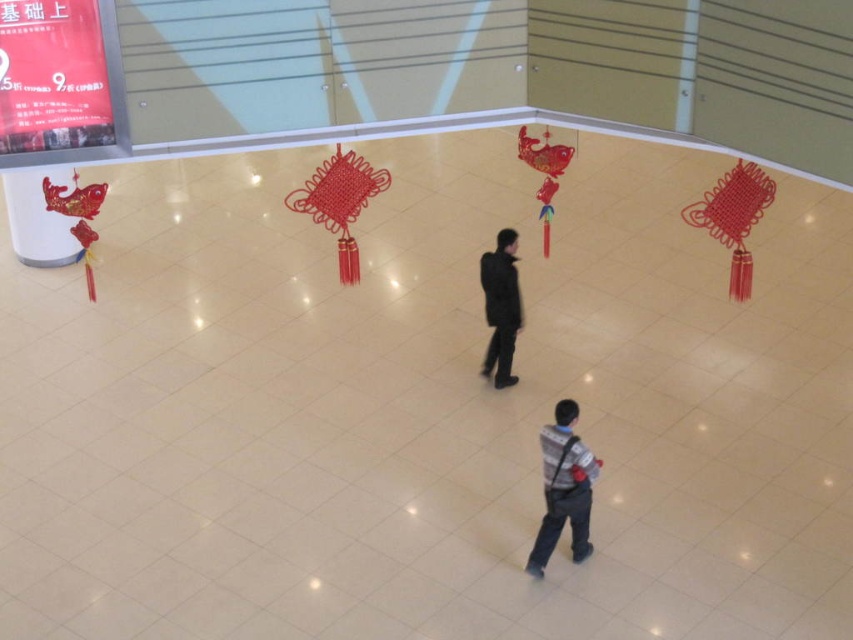
You are standing in the lobby and need to locate two points marked on the floor. The first point is at coordinates point (556, 433) and the second is at point (488, 259). Which point is closer to you?

Point (556, 433) is closer to the viewer than point (488, 259).